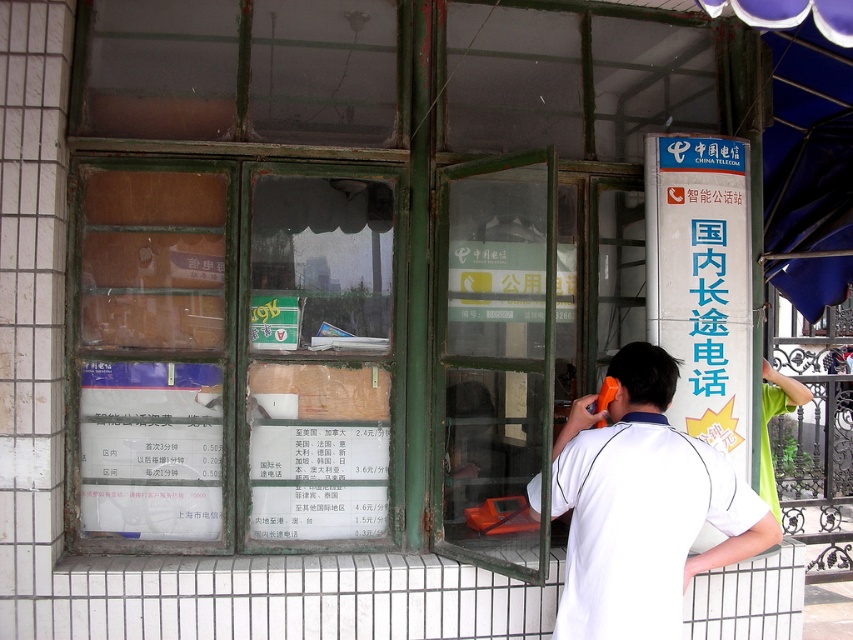
You are standing in front of the public telephone booth and want to locate two points marked on the booth. The first point is at coordinate point [390,387] and the second is at point [674,612]. From your perspective, which point is closer to you?

Point [674,612] is closer to you because it is in front of point [390,387].

You are standing in front of a public telephone booth and want to make a call. Where is the transparent glass window at center located in relation to the booth?

The transparent glass window at center is located at point 0.555 on the x axis and 0.281 on the y axis.